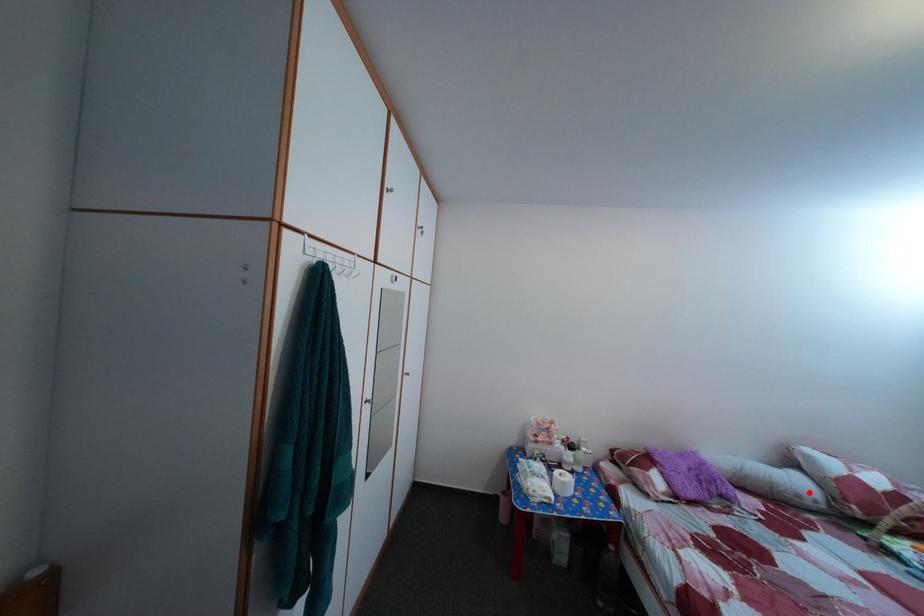
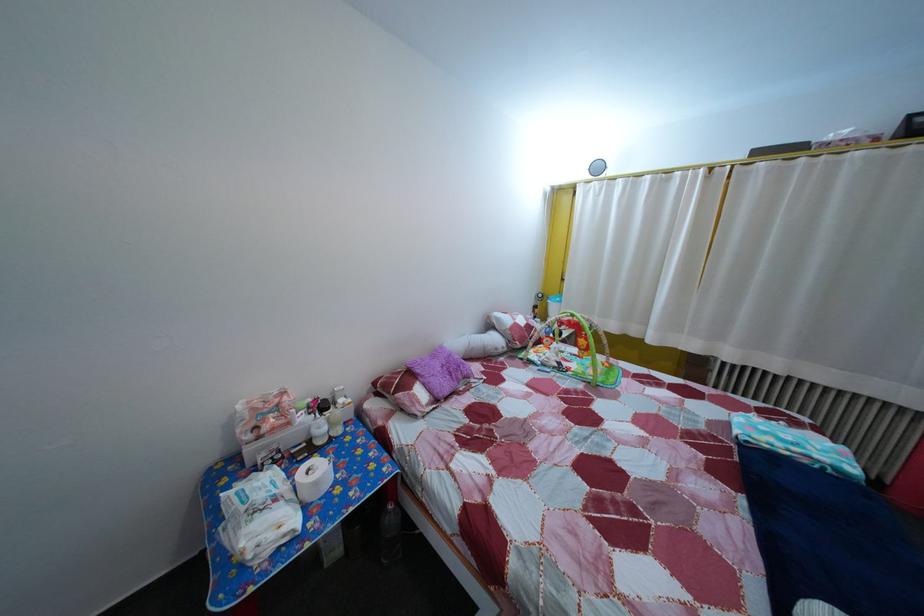
In the second image, find the point that corresponds to the highlighted location in the first image.

(505, 347)